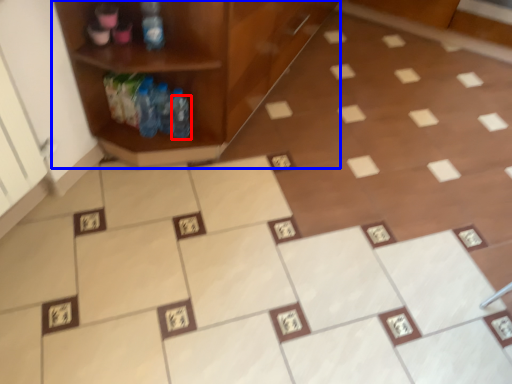
Question: Which object appears farthest to the camera in this image, bottle (highlighted by a red box) or shelf (highlighted by a blue box)?

Choices:
 (A) bottle
 (B) shelf

Answer: (A)